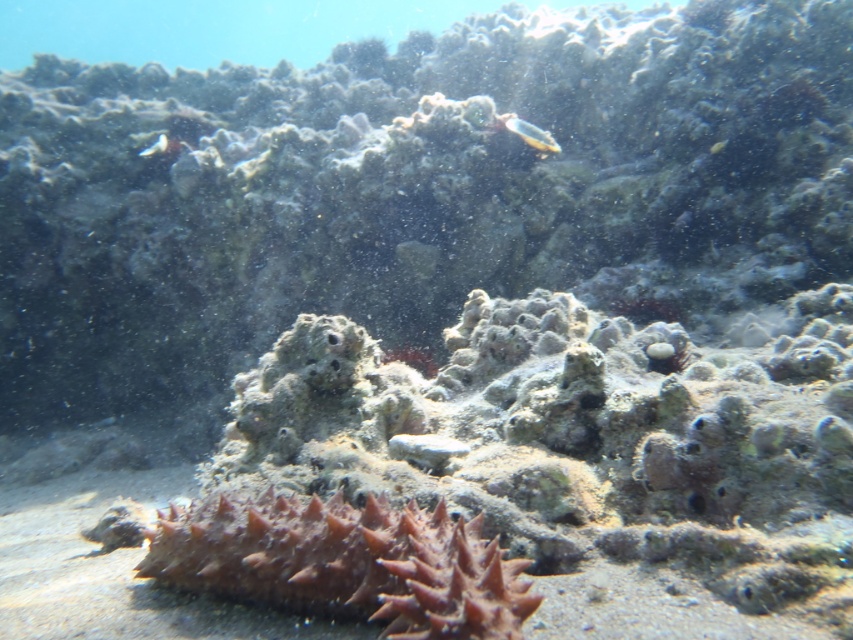
Question: From the image, what is the correct spatial relationship of translucent plastic fish at upper center in relation to translucent white fish at upper left?

Choices:
 (A) below
 (B) above

Answer: (A)

Question: Considering the real-world distances, which object is farthest from the brown spiky sea cucumber at center?

Choices:
 (A) translucent white fish at upper left
 (B) translucent plastic fish at upper center

Answer: (A)

Question: Which of the following is the farthest from the observer?

Choices:
 (A) (434, 536)
 (B) (144, 156)
 (C) (556, 150)

Answer: (B)

Question: Which of the following is the farthest from the observer?

Choices:
 (A) (554, 148)
 (B) (157, 140)
 (C) (196, 556)

Answer: (B)

Question: Does brown spiky sea cucumber at center have a greater width compared to translucent white fish at upper left?

Choices:
 (A) yes
 (B) no

Answer: (A)

Question: Observing the image, what is the correct spatial positioning of brown spiky sea cucumber at center in reference to translucent plastic fish at upper center?

Choices:
 (A) right
 (B) left

Answer: (B)